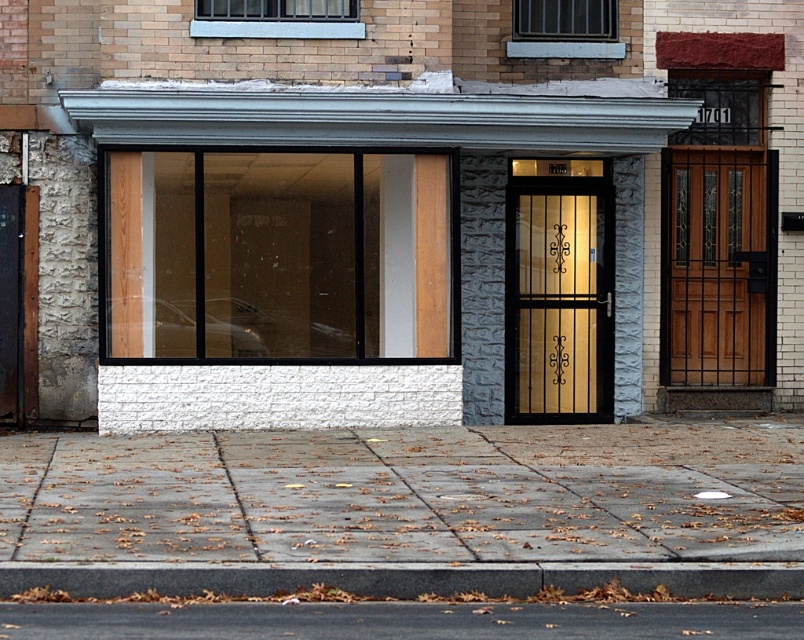
You are standing at the corner of the street where the building is located. You need to place a small potted plant exactly at the point where the gray concrete pavement at lower center is located. According to the coordinates provided, where should you place the potted plant?

You should place the potted plant at the coordinates point (405, 509) where the gray concrete pavement at lower center is located.

You are a delivery person trying to enter the building. You need to deliver a package to the office on the ground floor. The office is located to the right of the entrance. Which door should you use between the gold textured glass door at center and the mahogany wood door at right?

You should use the mahogany wood door at right because the gold textured glass door at center is to the left of it, so the office to the right of the entrance would be near the mahogany wood door at right.